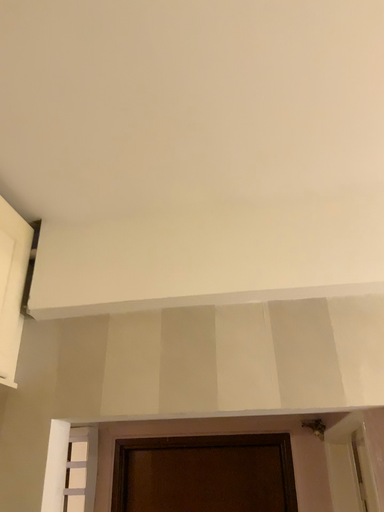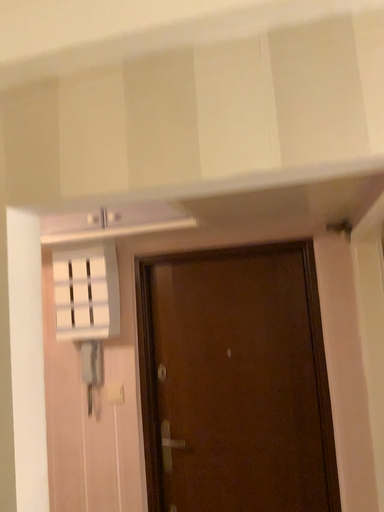
Question: Which way did the camera rotate in the video?

Choices:
 (A) rotated upward
 (B) rotated downward

Answer: (B)